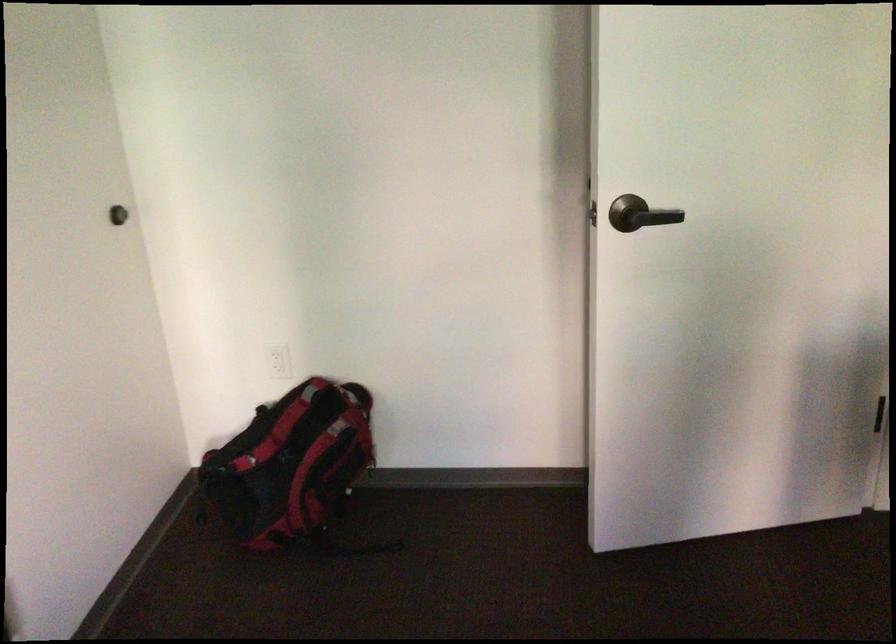
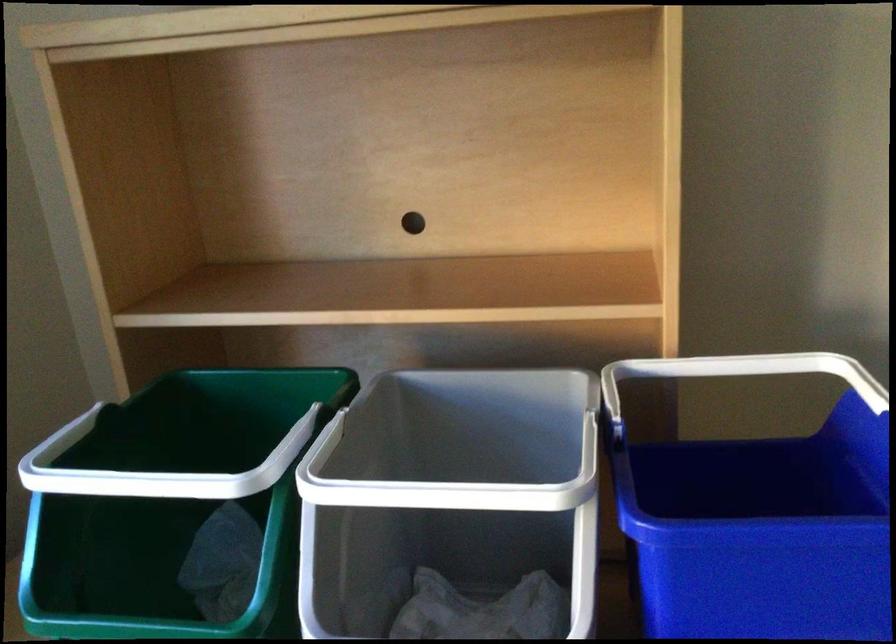
Based on the continuous images, in which direction is the camera rotating?

The camera rotated toward left-down.